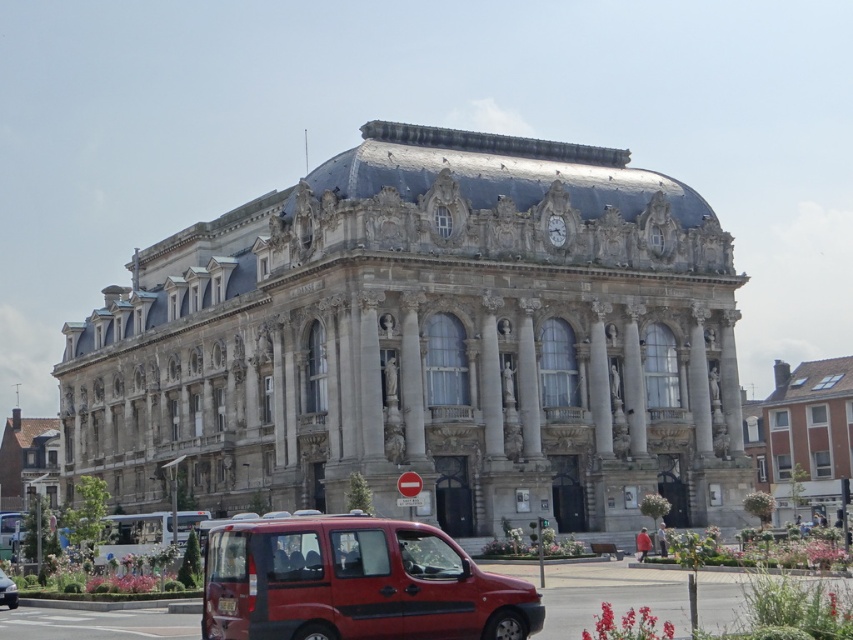
Question: Can you confirm if red brick building at right is positioned to the right of metallic red van at center?

Choices:
 (A) yes
 (B) no

Answer: (A)

Question: Among these objects, which one is nearest to the camera?

Choices:
 (A) stone building at center
 (B) metallic red van at lower center
 (C) red brick building at right
 (D) brick building at left

Answer: (B)

Question: Which object is the farthest from the brick building at left?

Choices:
 (A) red brick building at right
 (B) stone building at center

Answer: (A)

Question: Is stone building at center closer to the viewer compared to red brick building at right?

Choices:
 (A) no
 (B) yes

Answer: (B)

Question: Among these points, which one is nearest to the camera?

Choices:
 (A) (41, 426)
 (B) (242, 612)

Answer: (B)

Question: Is red brick building at right wider than brick building at left?

Choices:
 (A) no
 (B) yes

Answer: (B)